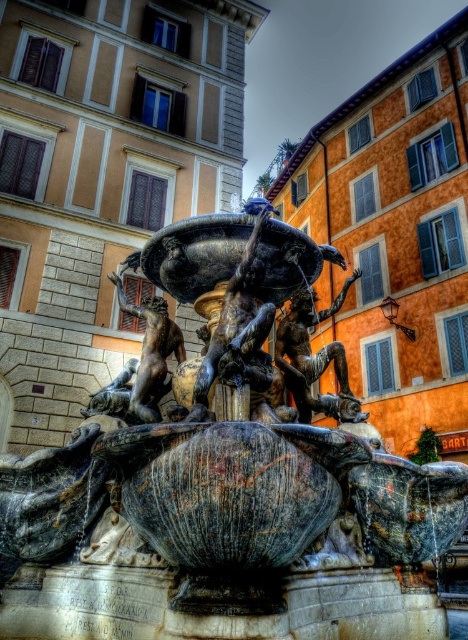
You are an art student visiting the fountain and want to sketch both the marble statue at center and the bronze statue at center. Which statue should you choose if you want to draw a larger subject?

The marble statue at center is larger in size than the bronze statue at center, so you should choose the marble statue at center for a larger subject.

You are standing in the square and want to take a photo of the fountain. You notice two points on the fountain, one at coordinates point [285,445] and another at point [337,300]. Which point will appear larger in your camera view?

Point [285,445] is closer to the viewer than point [337,300], so it will appear larger in the camera view.